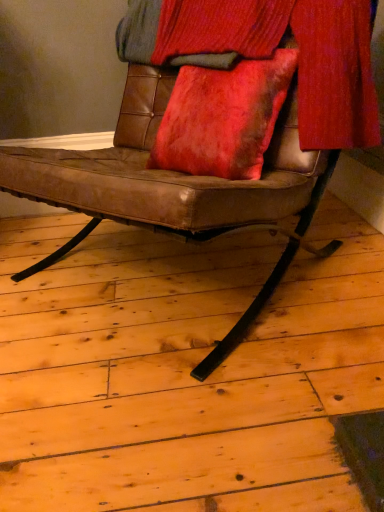
Question: Is brown leather chair at center bigger than velvet red curtain at upper center?

Choices:
 (A) yes
 (B) no

Answer: (A)

Question: From the image's perspective, does brown leather chair at center appear higher than velvet red curtain at upper center?

Choices:
 (A) yes
 (B) no

Answer: (B)

Question: Can you confirm if brown leather chair at center is shorter than velvet red curtain at upper center?

Choices:
 (A) yes
 (B) no

Answer: (B)

Question: Can we say brown leather chair at center lies outside velvet red curtain at upper center?

Choices:
 (A) no
 (B) yes

Answer: (B)

Question: Is brown leather chair at center to the left of velvet red curtain at upper center from the viewer's perspective?

Choices:
 (A) no
 (B) yes

Answer: (B)

Question: Does brown leather chair at center contain velvet red curtain at upper center?

Choices:
 (A) no
 (B) yes

Answer: (B)

Question: Considering the relative sizes of velvet red curtain at upper center and brown leather chair at center in the image provided, is velvet red curtain at upper center thinner than brown leather chair at center?

Choices:
 (A) no
 (B) yes

Answer: (B)

Question: Can you confirm if velvet red curtain at upper center is positioned to the right of brown leather chair at center?

Choices:
 (A) yes
 (B) no

Answer: (A)

Question: Is velvet red curtain at upper center smaller than brown leather chair at center?

Choices:
 (A) yes
 (B) no

Answer: (A)

Question: Is the depth of velvet red curtain at upper center greater than that of brown leather chair at center?

Choices:
 (A) no
 (B) yes

Answer: (B)

Question: From the image's perspective, does velvet red curtain at upper center appear lower than brown leather chair at center?

Choices:
 (A) yes
 (B) no

Answer: (B)

Question: Is velvet red curtain at upper center outside brown leather chair at center?

Choices:
 (A) no
 (B) yes

Answer: (A)

Question: From the image's perspective, is brown leather chair at center located above or below velvet red curtain at upper center?

Choices:
 (A) below
 (B) above

Answer: (A)